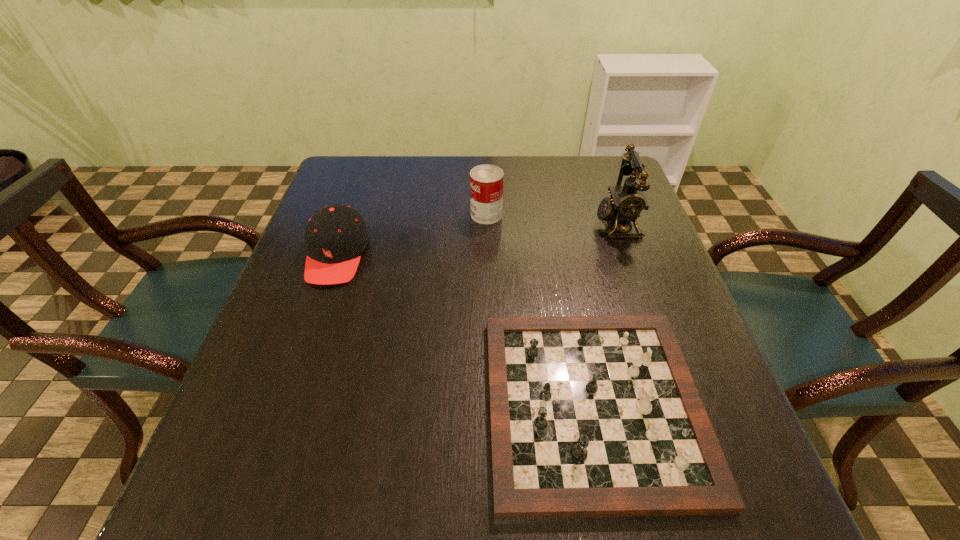
Find the location of a particular element. the tallest object is located at coordinates (626, 203).

Where is `the third shortest object`? the third shortest object is located at coordinates (486, 181).

At what (x,y) coordinates should I click in order to perform the action: click on cap. Please return your answer as a coordinate pair (x, y). The image size is (960, 540). Looking at the image, I should click on (336, 236).

Locate an element on the screen. the third tallest object is located at coordinates (336, 236).

Where is `the shortest object`? The image size is (960, 540). the shortest object is located at coordinates (591, 416).

Image resolution: width=960 pixels, height=540 pixels. Identify the location of the nearest object. (591, 416).

Image resolution: width=960 pixels, height=540 pixels. Find the location of `blank space located on the rotary dial of the tallest object`. blank space located on the rotary dial of the tallest object is located at coordinates (549, 224).

Where is `vacant space located on the rotary dial of the tallest object`? vacant space located on the rotary dial of the tallest object is located at coordinates (564, 224).

Find the location of `free region located 0.120m on the rotary dial of the tallest object`. free region located 0.120m on the rotary dial of the tallest object is located at coordinates (549, 224).

You are a GUI agent. You are given a task and a screenshot of the screen. Output one action in this format:
    pyautogui.click(x=<x>, y=<y>)
    Task: Click on the blank space located 0.370m on the front label of the can
    This screenshot has width=960, height=540.
    Given the screenshot: What is the action you would take?
    pyautogui.click(x=331, y=214)